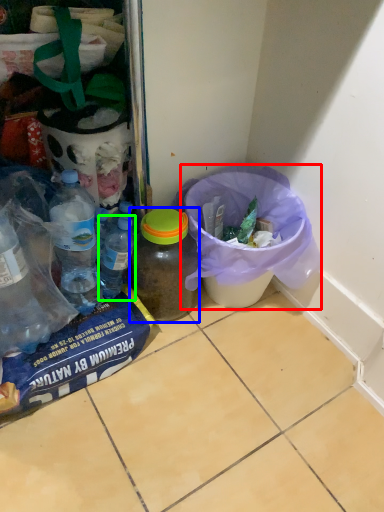
Question: Which object is the farthest from recycling bin (highlighted by a red box)? Choose among these: bottle (highlighted by a blue box) or bottle (highlighted by a green box).

Choices:
 (A) bottle
 (B) bottle

Answer: (B)